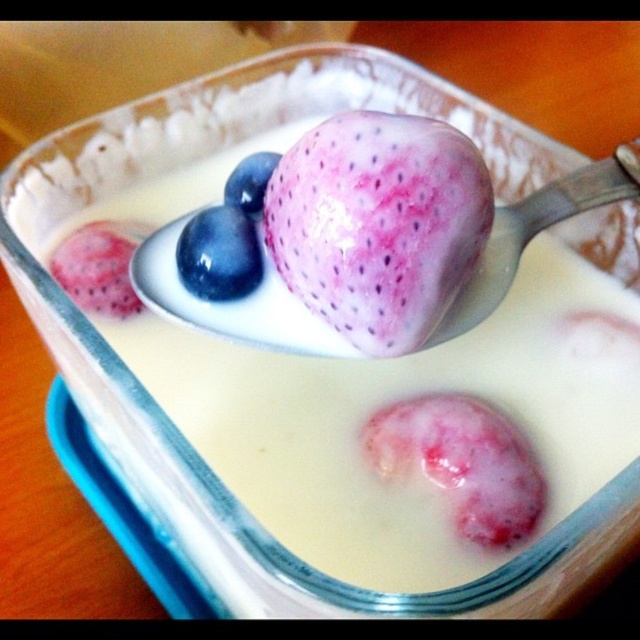
Consider the image. You are holding a ruler and want to measure the distance from your eyes to the pink glossy fruit at center in the dessert bowl. If the ruler is 30 centimeters long, can you fully measure the distance with just one ruler?

The pink glossy fruit at center is 49.67 centimeters away from the viewer. Since the ruler is only 30 centimeters long, you cannot fully measure the distance with just one ruler.